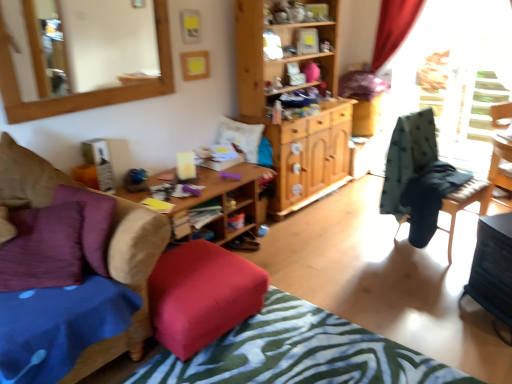
Identify the location of free space to the back side of black glossy table at lower right. This screenshot has height=384, width=512. (448, 279).